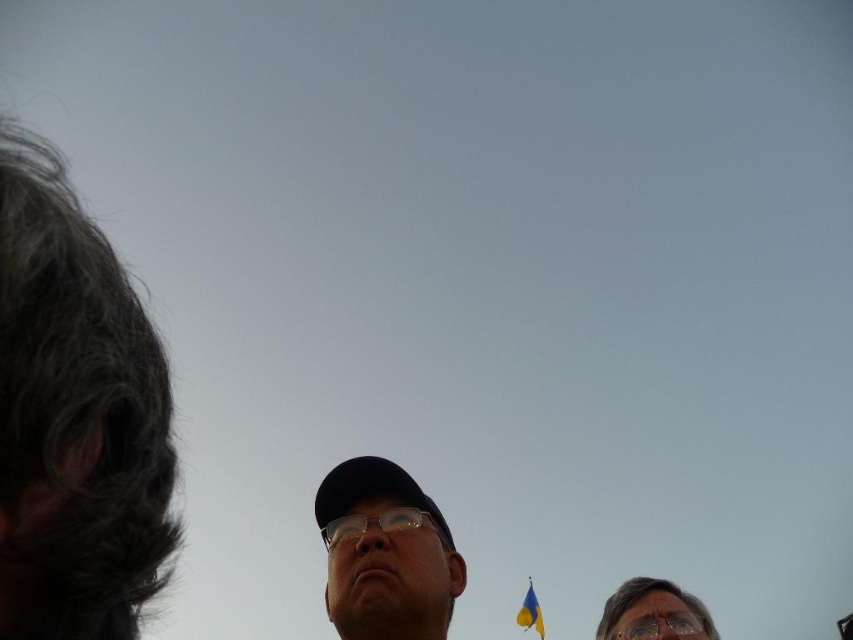
Identify the location of gray hair at left. Image resolution: width=853 pixels, height=640 pixels. (74, 417).

Who is lower down, gray hair at left or transparent plastic glasses at center?

transparent plastic glasses at center is lower down.

Which is more to the right, gray hair at left or transparent plastic glasses at center?

From the viewer's perspective, transparent plastic glasses at center appears more on the right side.

Who is more distant from viewer, (22,464) or (329,520)?

Positioned behind is point (329,520).

Locate an element on the screen. The height and width of the screenshot is (640, 853). gray hair at left is located at coordinates (74, 417).

Where is `gray hair at left`? gray hair at left is located at coordinates (74, 417).

Find the location of a particular element. The width and height of the screenshot is (853, 640). gray hair at left is located at coordinates (74, 417).